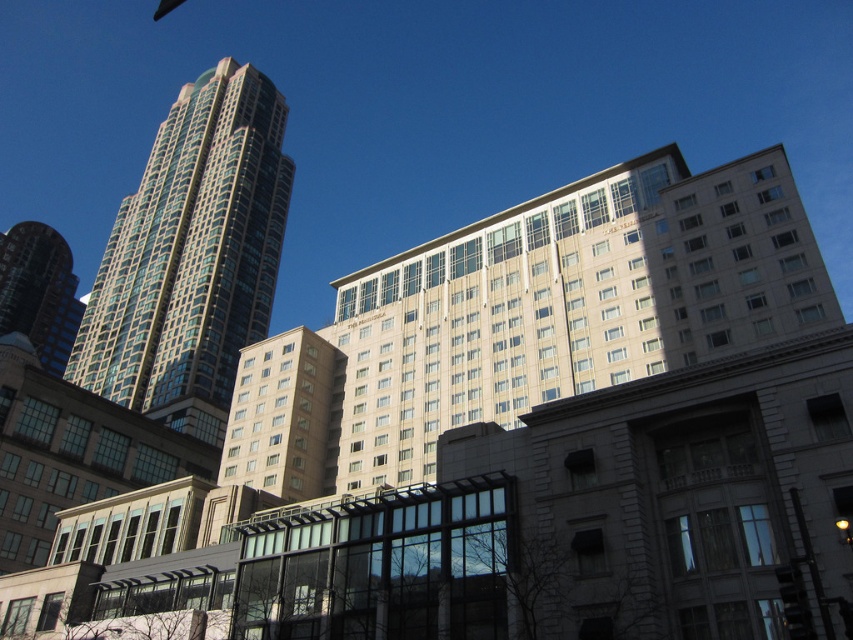
Is glassy teal skyscraper at upper left wider than shiny glass skyscraper at left?

Correct, the width of glassy teal skyscraper at upper left exceeds that of shiny glass skyscraper at left.

Can you confirm if glassy teal skyscraper at upper left is taller than shiny glass skyscraper at left?

Yes.

Where is `glassy teal skyscraper at upper left`? glassy teal skyscraper at upper left is located at coordinates (190, 253).